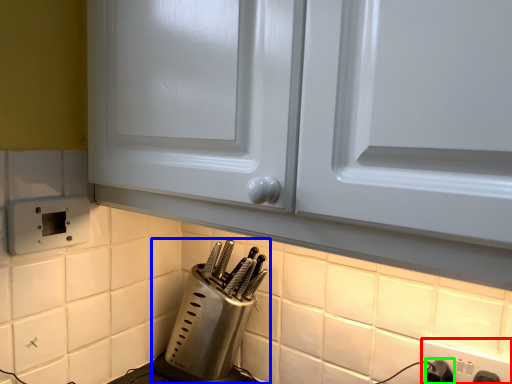
Question: Which is farther away from electric outlet (highlighted by a red box)? kitchen appliance (highlighted by a blue box) or switch (highlighted by a green box)?

Choices:
 (A) kitchen appliance
 (B) switch

Answer: (A)